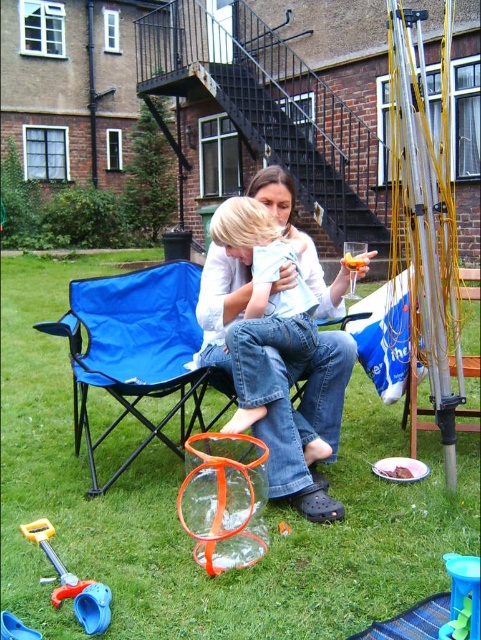
You are a guest at a backyard party and want to grab a drink from the translucent plastic cup at lower right. However, you notice the brown crumbly cake at lower center is blocking your access. Can you reach the cup without moving the cake?

The translucent plastic cup at lower right is below the brown crumbly cake at lower center, so you can reach it by moving around the cake or accessing it from the side without disturbing the cake.

You are planning to place a small table next to the blue fabric chair at left for snacks. Based on the coordinates provided, where should you position the table relative to the chair?

The blue fabric chair at left is located at point (135, 349), so you should position the table near those coordinates to place it next to the chair.